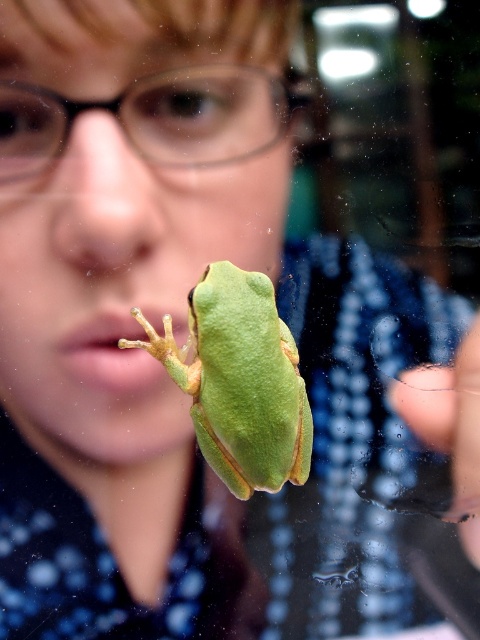
You are a photographer trying to capture a detailed shot of the frog. You have a black plastic glasses at upper center and a transparent glass finger at lower right in your frame. Which object should you adjust your focus to ensure the frog is sharp?

You should focus on the black plastic glasses at upper center because it is closer to the viewer than the transparent glass finger at lower right, so adjusting focus to the closer object will ensure the frog remains sharp.